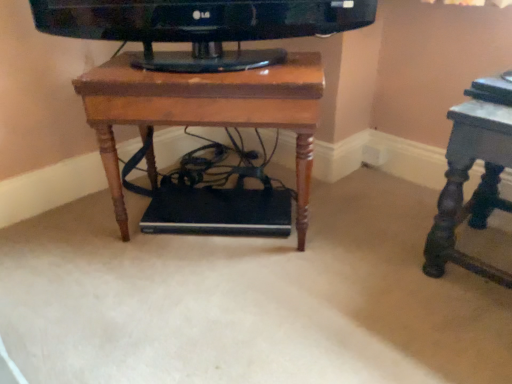
Question: Considering the relative sizes of wooden table at center, arranged as the first table when viewed from the left, and dark gray polished wood table at right, positioned as the first table in right-to-left order, in the image provided, is wooden table at center, arranged as the first table when viewed from the left, shorter than dark gray polished wood table at right, positioned as the first table in right-to-left order,?

Choices:
 (A) yes
 (B) no

Answer: (B)

Question: Considering the relative sizes of wooden table at center, arranged as the first table when viewed from the left, and dark gray polished wood table at right, which is counted as the second table, starting from the left, in the image provided, is wooden table at center, arranged as the first table when viewed from the left, smaller than dark gray polished wood table at right, which is counted as the second table, starting from the left,?

Choices:
 (A) no
 (B) yes

Answer: (A)

Question: Is wooden table at center, arranged as the 2th table when viewed from the right, positioned in front of dark gray polished wood table at right, positioned as the first table in right-to-left order?

Choices:
 (A) yes
 (B) no

Answer: (B)

Question: Could you tell me if wooden table at center, arranged as the 2th table when viewed from the right, is turned towards dark gray polished wood table at right, which is counted as the second table, starting from the left?

Choices:
 (A) yes
 (B) no

Answer: (B)

Question: Are wooden table at center, arranged as the 2th table when viewed from the right, and dark gray polished wood table at right, positioned as the first table in right-to-left order, far apart?

Choices:
 (A) yes
 (B) no

Answer: (B)

Question: From the image's perspective, is wooden table at center, arranged as the first table when viewed from the left, beneath dark gray polished wood table at right, positioned as the first table in right-to-left order?

Choices:
 (A) yes
 (B) no

Answer: (B)

Question: Is dark gray polished wood table at right, positioned as the first table in right-to-left order, positioned behind wooden table at center, arranged as the first table when viewed from the left?

Choices:
 (A) yes
 (B) no

Answer: (B)

Question: Does dark gray polished wood table at right, positioned as the first table in right-to-left order, have a greater height compared to wooden table at center, arranged as the first table when viewed from the left?

Choices:
 (A) no
 (B) yes

Answer: (A)

Question: Would you consider dark gray polished wood table at right, which is counted as the second table, starting from the left, to be distant from wooden table at center, arranged as the 2th table when viewed from the right?

Choices:
 (A) yes
 (B) no

Answer: (B)

Question: Could you tell me if dark gray polished wood table at right, which is counted as the second table, starting from the left, is turned towards wooden table at center, arranged as the first table when viewed from the left?

Choices:
 (A) no
 (B) yes

Answer: (A)

Question: From the image's perspective, is dark gray polished wood table at right, positioned as the first table in right-to-left order, on top of wooden table at center, arranged as the 2th table when viewed from the right?

Choices:
 (A) no
 (B) yes

Answer: (A)

Question: Is dark gray polished wood table at right, positioned as the first table in right-to-left order, wider than wooden table at center, arranged as the 2th table when viewed from the right?

Choices:
 (A) no
 (B) yes

Answer: (A)

Question: Is point (297, 119) closer or farther from the camera than point (484, 178)?

Choices:
 (A) closer
 (B) farther

Answer: (A)